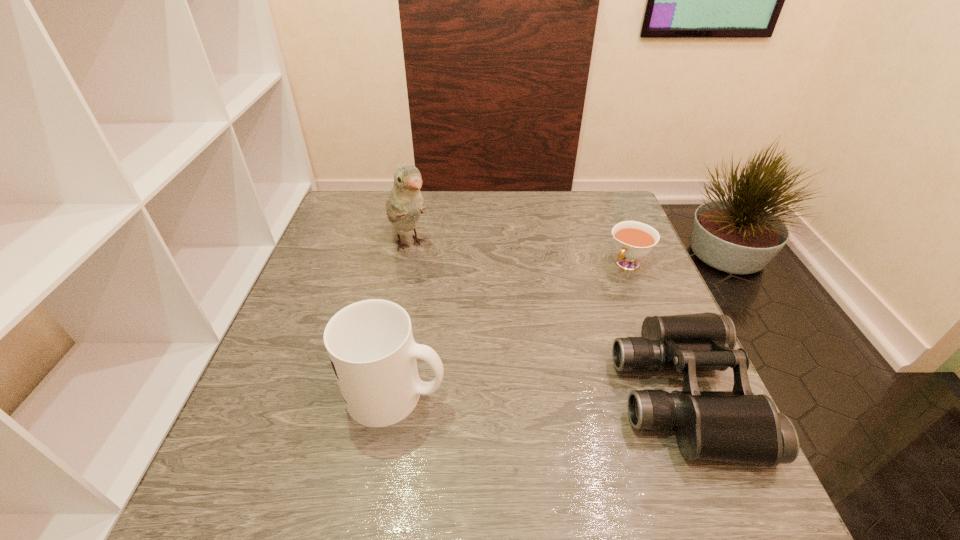
I want to click on free space located 0.370m at the face of the tallest object, so click(x=491, y=359).

The width and height of the screenshot is (960, 540). What are the coordinates of `object located in the far edge section of the desktop` in the screenshot? It's located at (405, 204).

Find the location of a particular element. This screenshot has width=960, height=540. mug that is at the near edge is located at coordinates (370, 343).

The width and height of the screenshot is (960, 540). Find the location of `binoculars positioned at the near edge`. binoculars positioned at the near edge is located at coordinates (736, 426).

Where is `binoculars present at the right edge`? This screenshot has height=540, width=960. binoculars present at the right edge is located at coordinates (736, 426).

Where is `teacup that is at the right edge`? teacup that is at the right edge is located at coordinates (633, 240).

Where is `object present at the near right corner`? object present at the near right corner is located at coordinates (736, 426).

Identify the location of free space at the far edge of the desktop. (429, 191).

This screenshot has width=960, height=540. In order to click on vacant space at the near edge of the desktop in this screenshot , I will do `click(545, 420)`.

Image resolution: width=960 pixels, height=540 pixels. I want to click on free space at the left edge of the desktop, so click(333, 236).